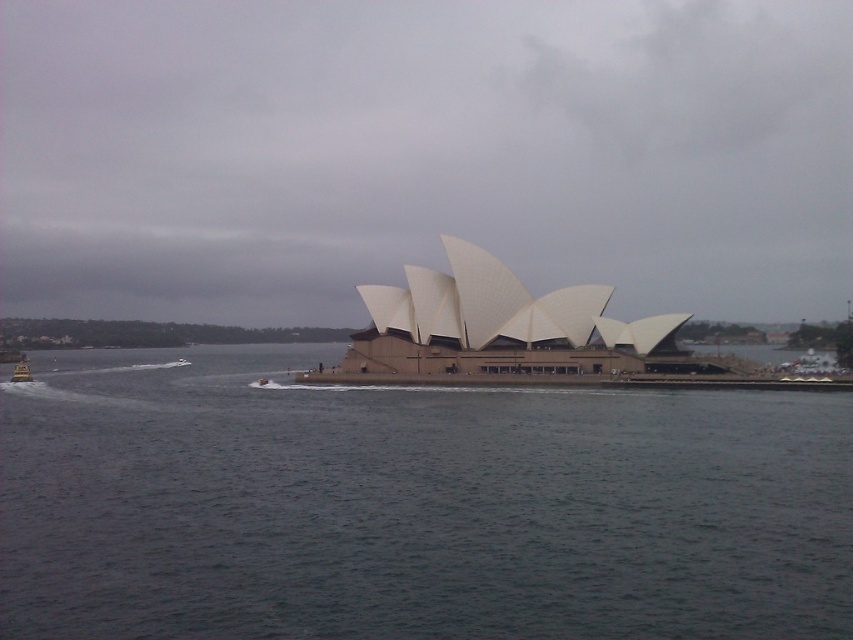
Does gray water at center have a lesser width compared to beige concrete opera house at center?

Incorrect, gray water at center's width is not less than beige concrete opera house at center's.

Does point (701, 493) come closer to viewer compared to point (521, 339)?

Yes, it is.

The height and width of the screenshot is (640, 853). Identify the location of gray water at center. (410, 506).

Does white matte sydney opera house at center come behind metallic silver boat at lower left?

No, it is not.

Between white matte sydney opera house at center and metallic silver boat at lower left, which one is positioned higher?

Positioned higher is white matte sydney opera house at center.

The image size is (853, 640). I want to click on white matte sydney opera house at center, so click(422, 152).

The height and width of the screenshot is (640, 853). Find the location of `white matte sydney opera house at center`. white matte sydney opera house at center is located at coordinates (422, 152).

At what (x,y) coordinates should I click in order to perform the action: click on white matte sydney opera house at center. Please return your answer as a coordinate pair (x, y). This screenshot has height=640, width=853. Looking at the image, I should click on (422, 152).

Which is above, white matte sydney opera house at center or beige concrete opera house at center?

Positioned higher is white matte sydney opera house at center.

Is point (258, 234) farther from viewer compared to point (633, 371)?

Yes, it is.

I want to click on white matte sydney opera house at center, so [x=422, y=152].